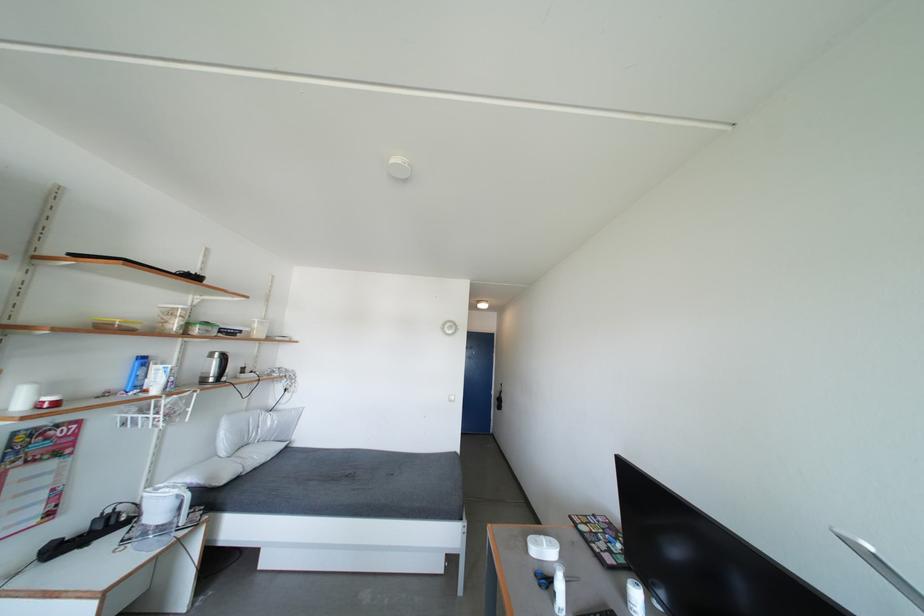
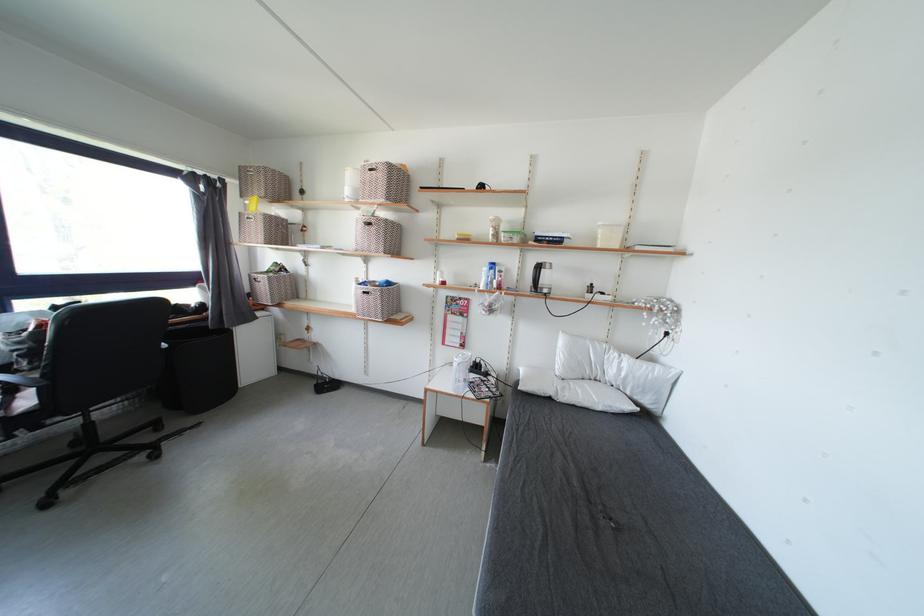
Locate, in the second image, the point that corresponds to [226,331] in the first image.

(543, 238)